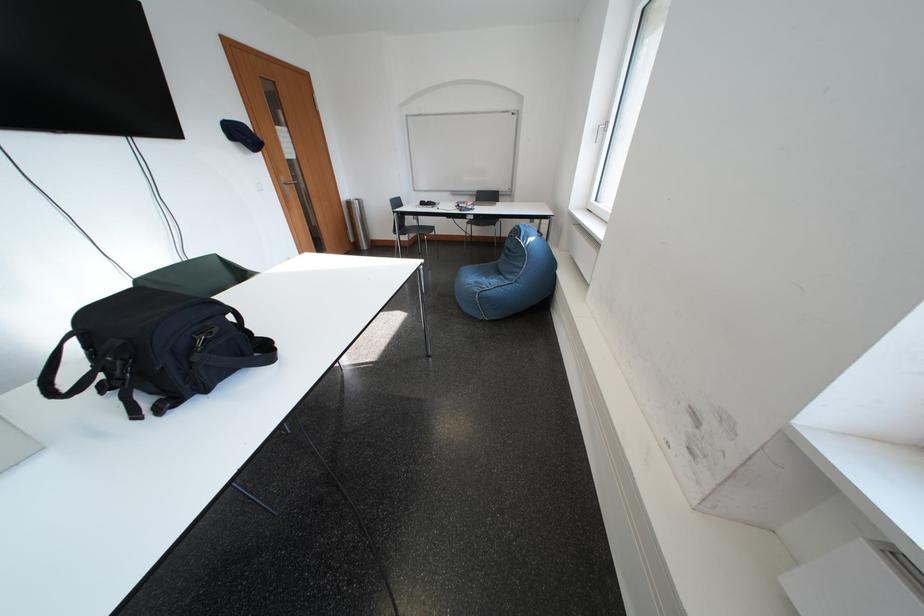
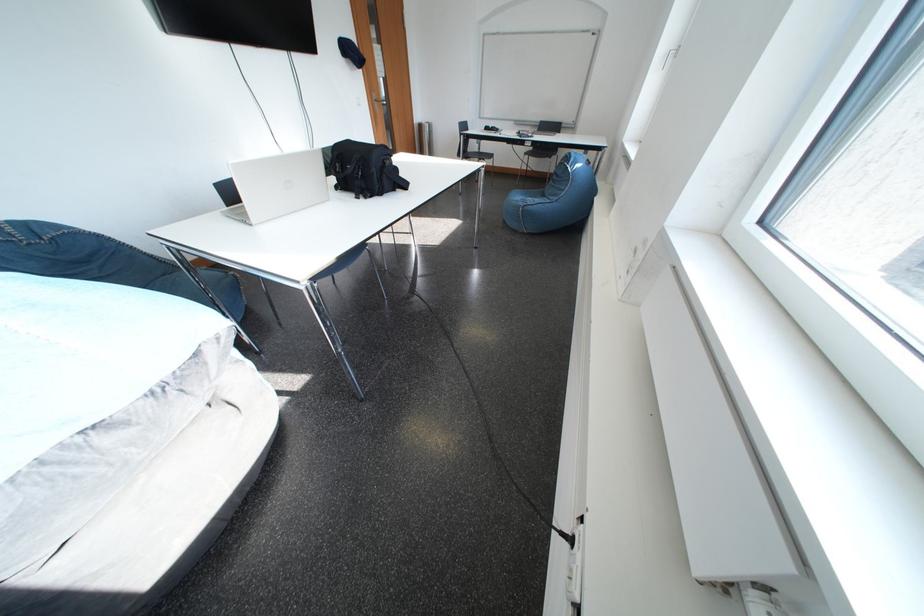
Question: What movement of the cameraman would produce the second image?

Choices:
 (A) Left
 (B) Right
 (C) Forward
 (D) Backward

Answer: (D)